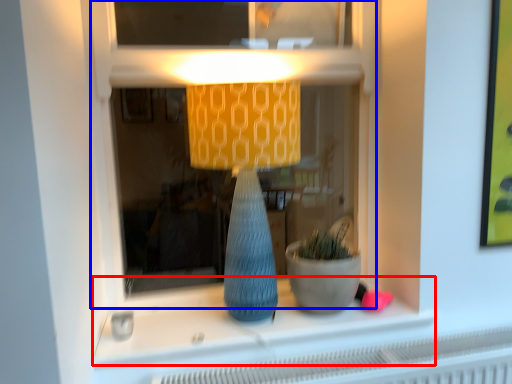
Question: Which object is further to the camera taking this photo, window sill (highlighted by a red box) or shop window (highlighted by a blue box)?

Choices:
 (A) window sill
 (B) shop window

Answer: (A)